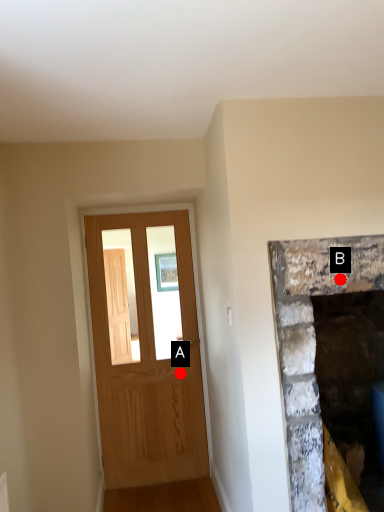
Question: Two points are circled on the image, labeled by A and B beside each circle. Which point is closer to the camera taking this photo?

Choices:
 (A) A is closer
 (B) B is closer

Answer: (B)